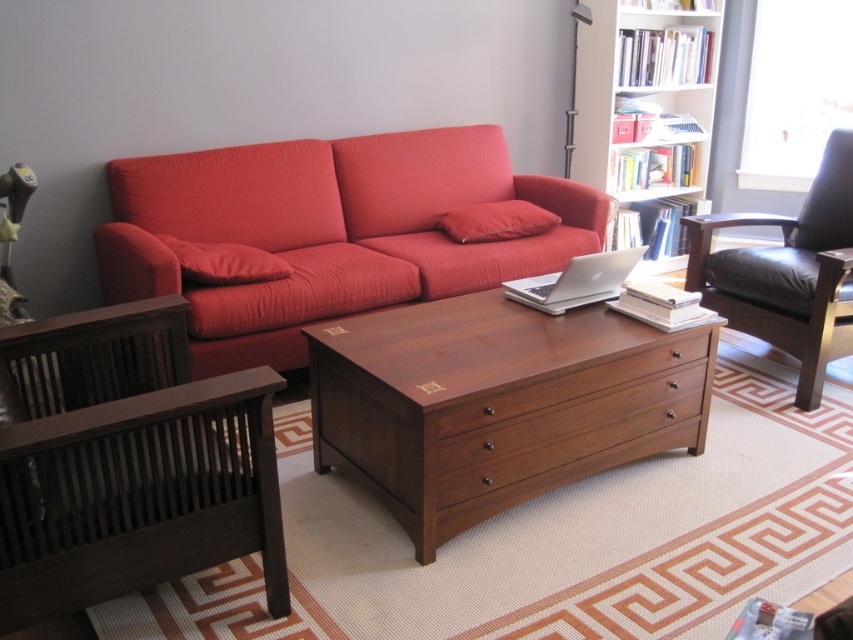
Can you confirm if dark brown wood armchair at left is shorter than brown wood drawer at center?

No.

Which is above, dark brown wood armchair at left or brown wood drawer at center?

dark brown wood armchair at left is higher up.

The image size is (853, 640). Describe the element at coordinates (132, 461) in the screenshot. I see `dark brown wood armchair at left` at that location.

Locate an element on the screen. The image size is (853, 640). dark brown wood armchair at left is located at coordinates (132, 461).

Which of these two, dark brown wood armchair at left or white wooden bookshelf at upper right, stands shorter?

dark brown wood armchair at left

Measure the distance between dark brown wood armchair at left and white wooden bookshelf at upper right.

They are 3.15 meters apart.

At what (x,y) coordinates should I click in order to perform the action: click on dark brown wood armchair at left. Please return your answer as a coordinate pair (x, y). Looking at the image, I should click on (132, 461).

Can you confirm if matte red couch at center is positioned above white wooden bookshelf at upper right?

No.

Based on the photo, does matte red couch at center have a lesser width compared to white wooden bookshelf at upper right?

No, matte red couch at center is not thinner than white wooden bookshelf at upper right.

Locate an element on the screen. Image resolution: width=853 pixels, height=640 pixels. matte red couch at center is located at coordinates (326, 230).